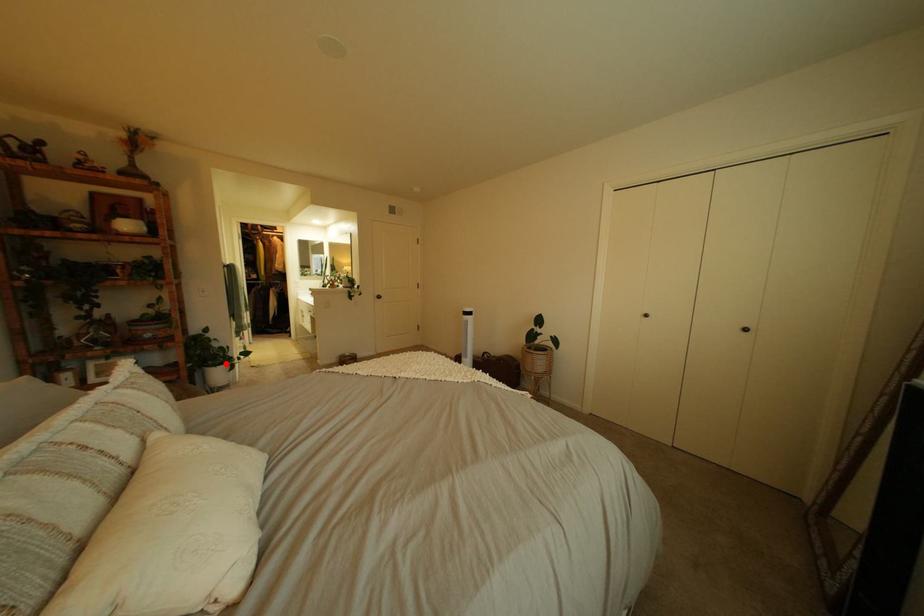
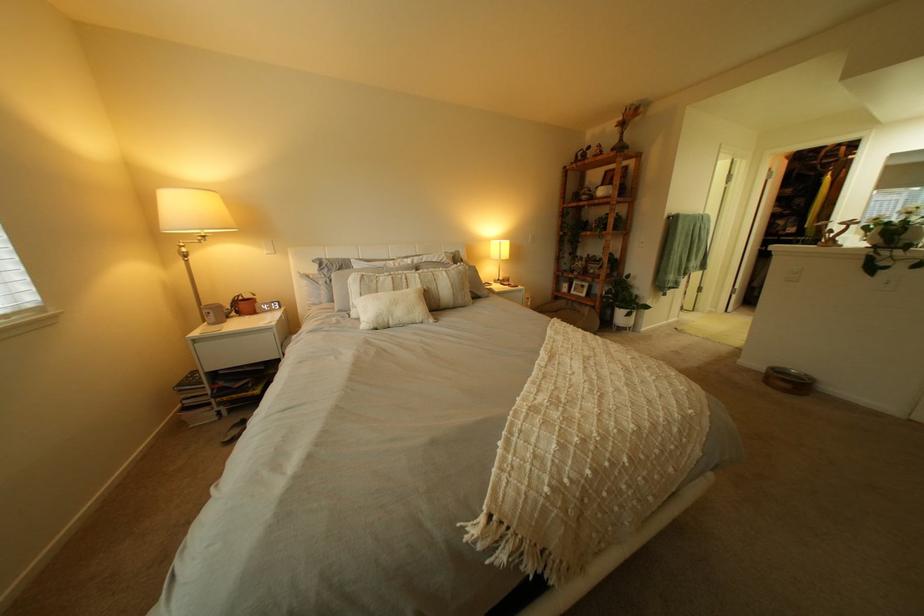
Find the pixel in the second image that matches the highlighted location in the first image.

(633, 305)